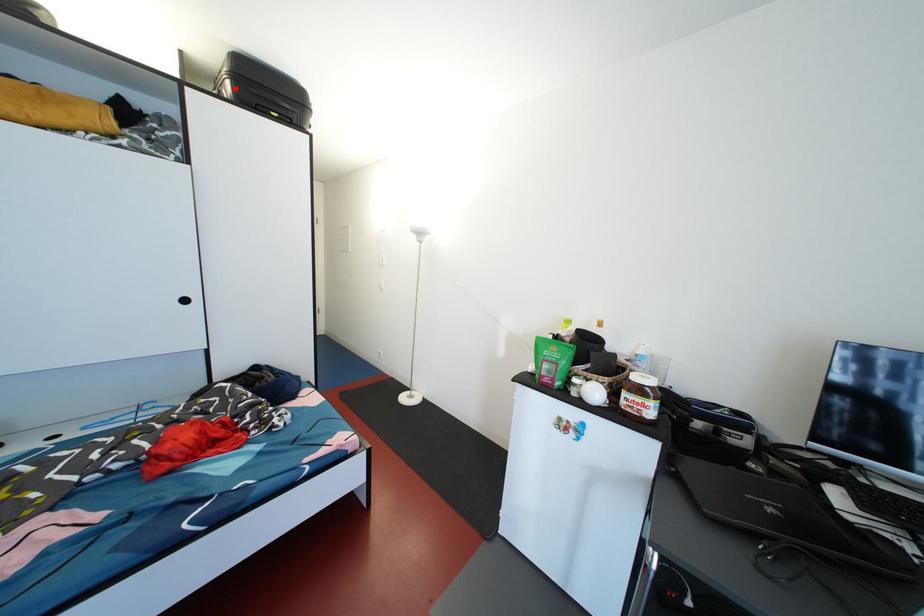
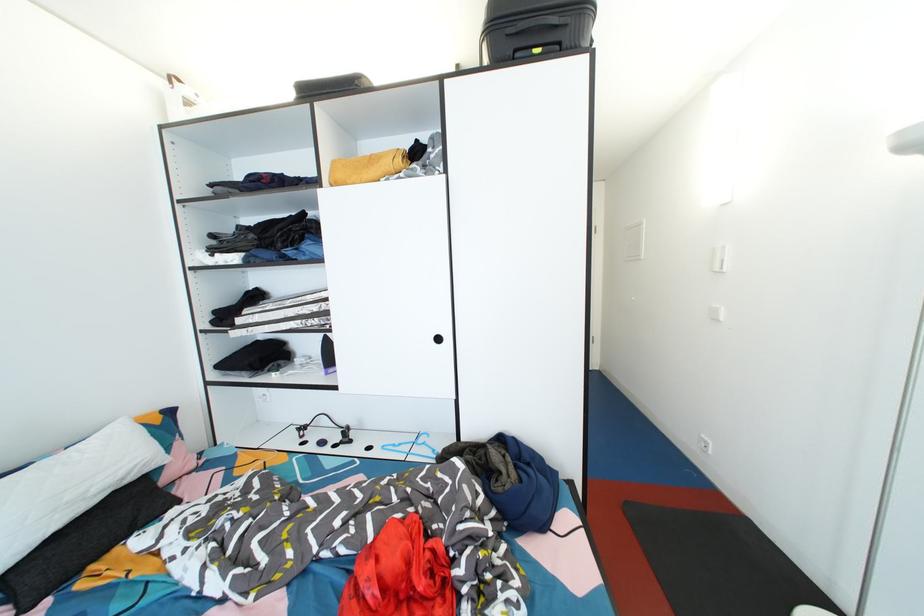
The point at the highlighted location is marked in the first image. Where is the corresponding point in the second image?

(492, 51)